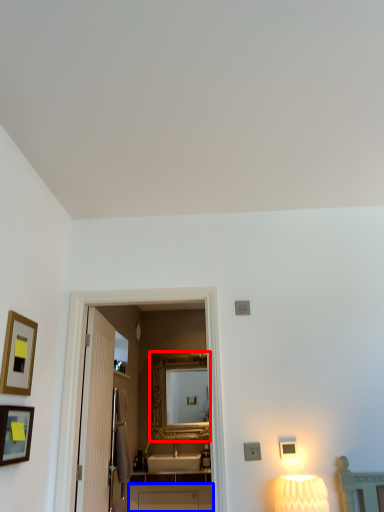
Question: Which point is further to the camera, mirror (highlighted by a red box) or cabinetry (highlighted by a blue box)?

Choices:
 (A) mirror
 (B) cabinetry

Answer: (A)